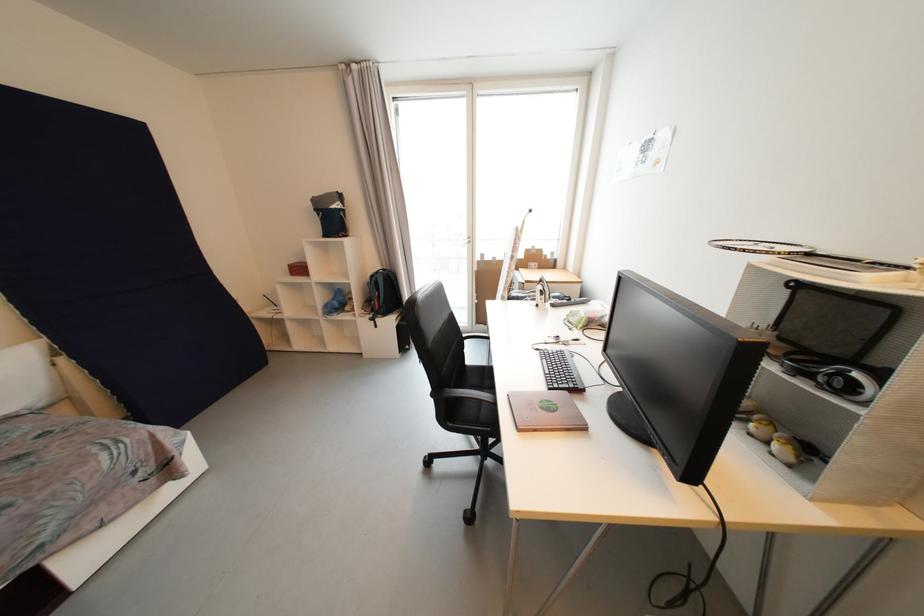
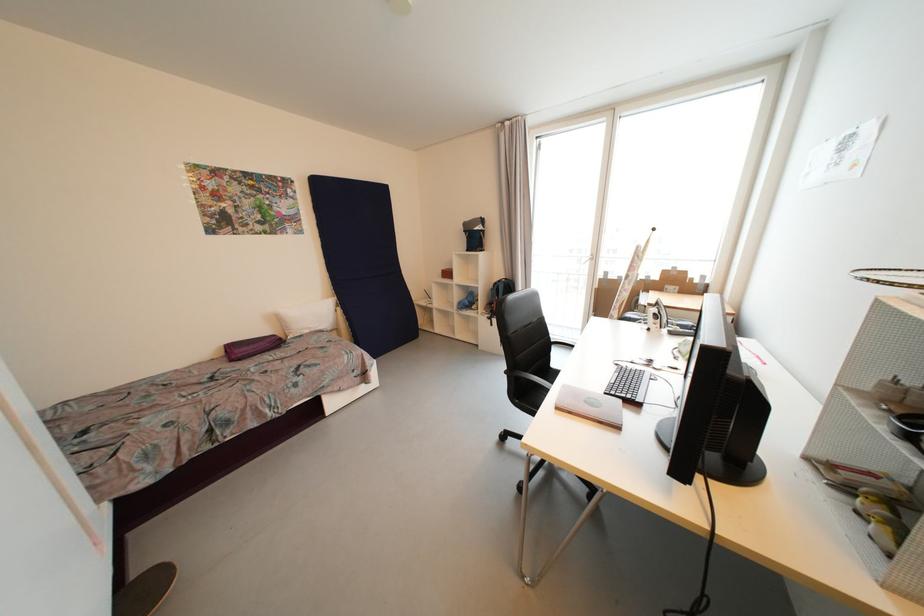
Where in the second image is the point corresponding to the point at 546,294 from the first image?

(662, 318)